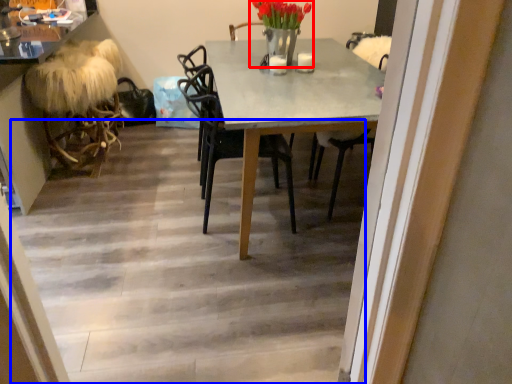
Question: Which point is further to the camera, floral arrangement (highlighted by a red box) or stairwell (highlighted by a blue box)?

Choices:
 (A) floral arrangement
 (B) stairwell

Answer: (A)